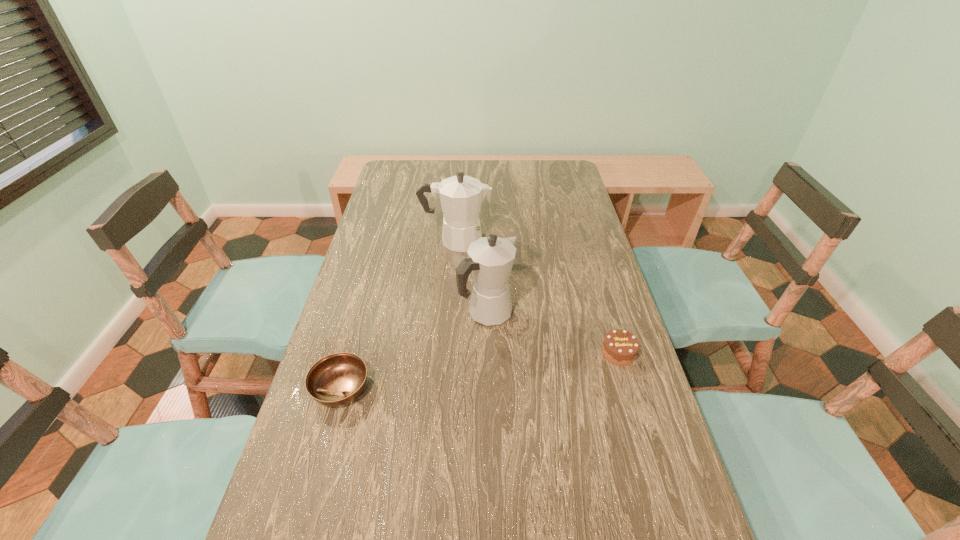
Find the location of `the nearer coffeepot`. the nearer coffeepot is located at coordinates (490, 259).

This screenshot has height=540, width=960. In order to click on the farthest object in this screenshot , I will do 461,196.

This screenshot has height=540, width=960. Identify the location of chocolate cake. (620, 347).

I want to click on the third tallest object, so click(620, 347).

The width and height of the screenshot is (960, 540). What are the coordinates of `the leftmost object` in the screenshot? It's located at (337, 379).

Where is `the shortest object`? The image size is (960, 540). the shortest object is located at coordinates (337, 379).

The width and height of the screenshot is (960, 540). In order to click on blank space located 0.230m on the left of the third nearest object in this screenshot , I will do `click(377, 314)`.

Where is `vacant region located at the spout of the farthest object`? vacant region located at the spout of the farthest object is located at coordinates (535, 240).

The image size is (960, 540). In order to click on vacant space located on the front of the second shortest object in this screenshot , I will do `click(636, 412)`.

I want to click on blank space located on the back of the soup bowl, so click(370, 285).